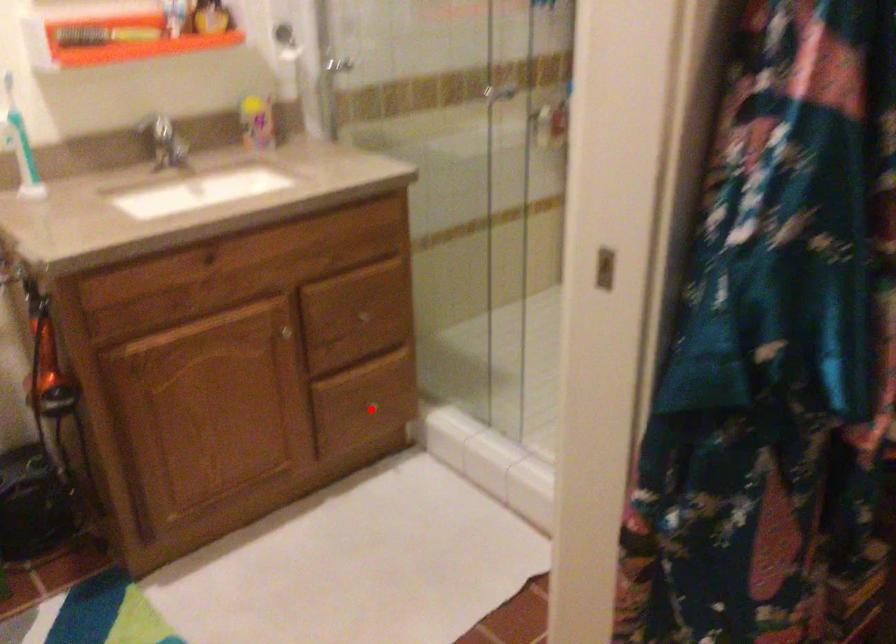
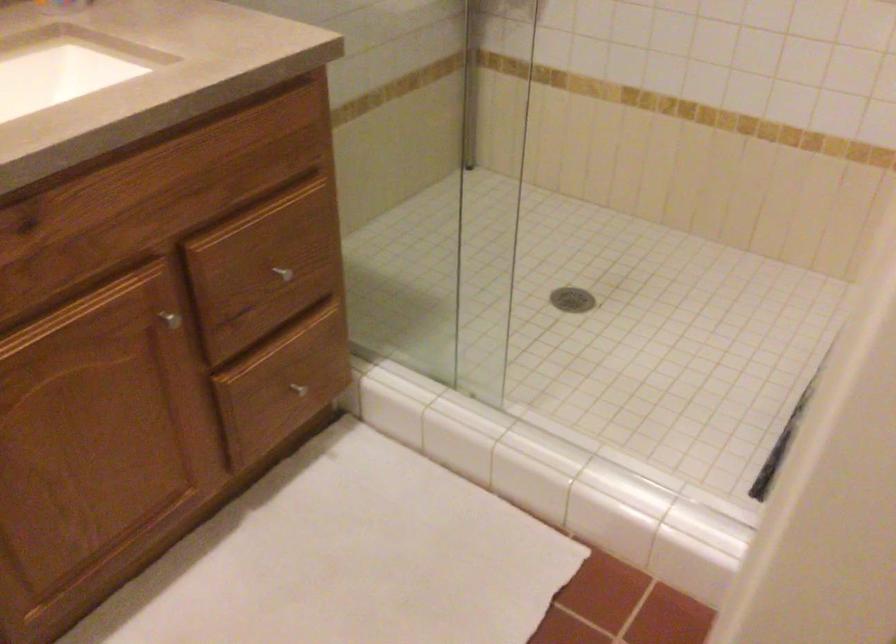
Locate, in the second image, the point that corresponds to the highlighted location in the first image.

(297, 389)